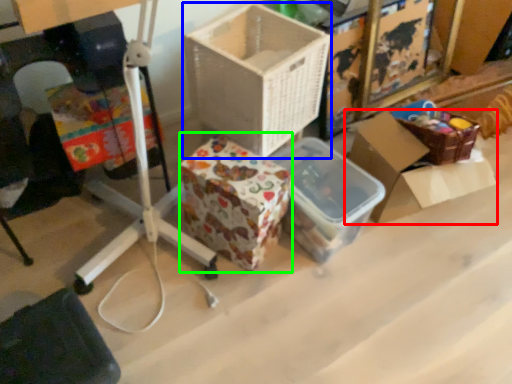
Question: Which object is positioned farthest from box (highlighted by a red box)? Select from box (highlighted by a blue box) and storage box (highlighted by a green box).

Choices:
 (A) box
 (B) storage box

Answer: (B)